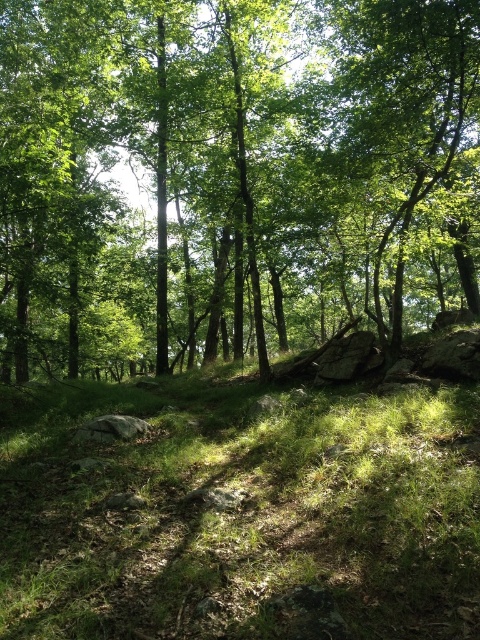
You are a hiker navigating through the forest and want to reach the green leafy tree at center. Based on the coordinates provided, can you determine the direction you should head to reach it?

The green leafy tree at center is located at coordinates point (232,176), so you should head towards that coordinate point to reach it.